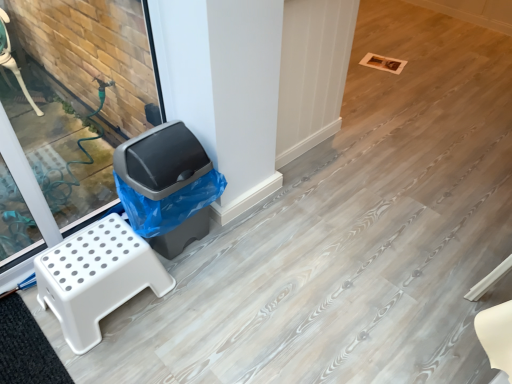
At what (x,y) coordinates should I click in order to perform the action: click on free space above white plastic step stool at left (from a real-world perspective). Please return your answer as a coordinate pair (x, y). Image resolution: width=512 pixels, height=384 pixels. Looking at the image, I should click on coord(93,244).